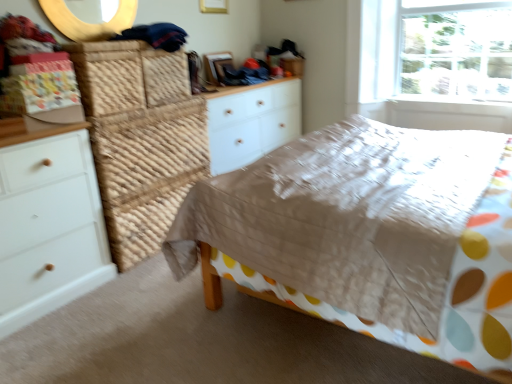
Question: Is white wood chest of drawers at center, arranged as the 1th chest of drawers when viewed from the right, far from wooden round mirror at upper center?

Choices:
 (A) no
 (B) yes

Answer: (B)

Question: Considering the relative sizes of white wood chest of drawers at center, the 2th chest of drawers from the left, and wooden round mirror at upper center in the image provided, is white wood chest of drawers at center, the 2th chest of drawers from the left, bigger than wooden round mirror at upper center?

Choices:
 (A) no
 (B) yes

Answer: (B)

Question: Is white wood chest of drawers at center, the second chest of drawers positioned from the front, facing away from wooden round mirror at upper center?

Choices:
 (A) no
 (B) yes

Answer: (A)

Question: From a real-world perspective, is white wood chest of drawers at center, which ranks as the first chest of drawers in back-to-front order, positioned under wooden round mirror at upper center based on gravity?

Choices:
 (A) yes
 (B) no

Answer: (A)

Question: Considering the relative positions of white wood chest of drawers at center, the second chest of drawers positioned from the front, and wooden round mirror at upper center in the image provided, is white wood chest of drawers at center, the second chest of drawers positioned from the front, to the left of wooden round mirror at upper center from the viewer's perspective?

Choices:
 (A) no
 (B) yes

Answer: (A)

Question: Could wooden round mirror at upper center be considered to be inside white wood chest of drawers at center, the 2th chest of drawers from the left?

Choices:
 (A) yes
 (B) no

Answer: (B)

Question: Considering the relative sizes of wooden round mirror at upper center and white wood chest of drawers at left, which is the second chest of drawers in back-to-front order, in the image provided, is wooden round mirror at upper center thinner than white wood chest of drawers at left, which is the second chest of drawers in back-to-front order,?

Choices:
 (A) yes
 (B) no

Answer: (A)

Question: From the image's perspective, is wooden round mirror at upper center below white wood chest of drawers at left, which ranks as the first chest of drawers in front-to-back order?

Choices:
 (A) yes
 (B) no

Answer: (B)

Question: Considering the relative sizes of wooden round mirror at upper center and white wood chest of drawers at left, which is the second chest of drawers in back-to-front order, in the image provided, is wooden round mirror at upper center smaller than white wood chest of drawers at left, which is the second chest of drawers in back-to-front order,?

Choices:
 (A) yes
 (B) no

Answer: (A)

Question: Would you say wooden round mirror at upper center is a long distance from white wood chest of drawers at left, which ranks as the first chest of drawers in front-to-back order?

Choices:
 (A) yes
 (B) no

Answer: (A)

Question: Is wooden round mirror at upper center next to white wood chest of drawers at left, which ranks as the first chest of drawers in front-to-back order, and touching it?

Choices:
 (A) no
 (B) yes

Answer: (A)

Question: Is white wood chest of drawers at left, which is the second chest of drawers in back-to-front order, completely or partially inside wooden round mirror at upper center?

Choices:
 (A) yes
 (B) no

Answer: (B)

Question: Does matte brown bed at center have a lesser width compared to white wood chest of drawers at left, the 1th chest of drawers positioned from the left?

Choices:
 (A) no
 (B) yes

Answer: (A)